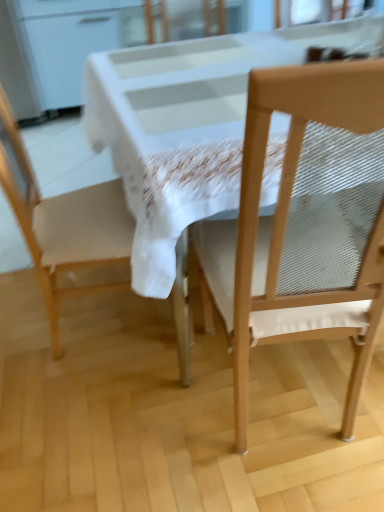
The height and width of the screenshot is (512, 384). Identify the location of blank space to the left of wooden chair at right, marked as the second chair in a left-to-right arrangement. (139, 415).